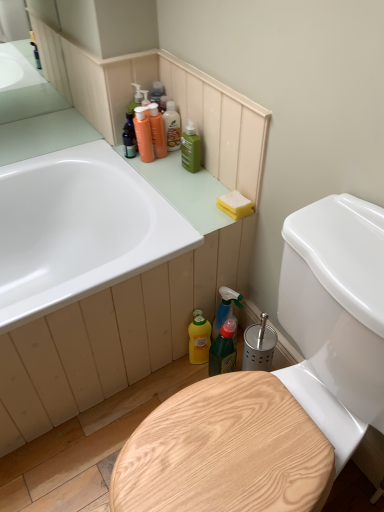
Image resolution: width=384 pixels, height=512 pixels. I want to click on vacant space to the left of green matte bottle at upper center, the 4th cleaning product positioned from the top, so click(x=153, y=167).